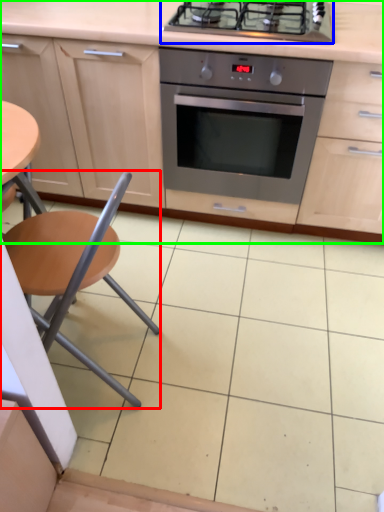
Question: Estimate the real-world distances between objects in this image. Which object is farther from chair (highlighted by a red box), gas stove (highlighted by a blue box) or cabinetry (highlighted by a green box)?

Choices:
 (A) gas stove
 (B) cabinetry

Answer: (A)